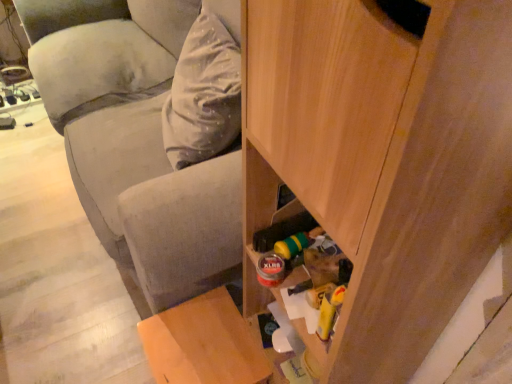
The image size is (512, 384). Find the location of `wooden cabinet at lower right`. wooden cabinet at lower right is located at coordinates (382, 161).

Image resolution: width=512 pixels, height=384 pixels. What do you see at coordinates (204, 343) in the screenshot?
I see `wooden stool at lower left` at bounding box center [204, 343].

Locate an element on the screen. wooden cabinet at lower right is located at coordinates (382, 161).

In terms of size, does wooden cabinet at lower right appear bigger or smaller than wooden stool at lower left?

Clearly, wooden cabinet at lower right is larger in size than wooden stool at lower left.

From a real-world perspective, between wooden cabinet at lower right and wooden stool at lower left, who is vertically higher?

wooden cabinet at lower right is physically above.

Does wooden cabinet at lower right appear on the right side of wooden stool at lower left?

Indeed, wooden cabinet at lower right is positioned on the right side of wooden stool at lower left.

Is wooden stool at lower left behind wooden cabinet at lower right?

That is True.

From a real-world perspective, is wooden stool at lower left physically above wooden cabinet at lower right?

Incorrect, from a real-world perspective, wooden stool at lower left is lower than wooden cabinet at lower right.

Is there a large distance between wooden stool at lower left and wooden cabinet at lower right?

wooden stool at lower left is near wooden cabinet at lower right, not far away.

Is point (245, 346) positioned behind point (282, 178)?

Yes.

Is velvety gray pillow at upper left positioned beyond the bounds of wooden cabinet at lower right?

velvety gray pillow at upper left lies outside wooden cabinet at lower right's area.

Consider the image. Does velvety gray pillow at upper left lie in front of wooden cabinet at lower right?

No, the depth of velvety gray pillow at upper left is greater than that of wooden cabinet at lower right.

From a real-world perspective, which is physically below, velvety gray pillow at upper left or wooden cabinet at lower right?

In real-world perspective, velvety gray pillow at upper left is lower.

How different are the orientations of velvety gray pillow at upper left and wooden cabinet at lower right in degrees?

5.49 degrees separate the facing orientations of velvety gray pillow at upper left and wooden cabinet at lower right.

Measure the distance from wooden cabinet at lower right to velvety gray pillow at upper left.

A distance of 24.25 inches exists between wooden cabinet at lower right and velvety gray pillow at upper left.

Are wooden cabinet at lower right and velvety gray pillow at upper left beside each other?

wooden cabinet at lower right is not next to velvety gray pillow at upper left, and they're not touching.

Does wooden cabinet at lower right have a smaller size compared to velvety gray pillow at upper left?

No, wooden cabinet at lower right is not smaller than velvety gray pillow at upper left.

Between wooden cabinet at lower right and velvety gray pillow at upper left, which one appears on the right side from the viewer's perspective?

wooden cabinet at lower right.

Which is nearer, (221, 107) or (198, 376)?

Point (221, 107).

Is velvety gray pillow at upper left placed right next to wooden stool at lower left?

No, velvety gray pillow at upper left is not next to wooden stool at lower left.

Between velvety gray pillow at upper left and wooden stool at lower left, which one is positioned in front?

wooden stool at lower left is closer to the camera.

From the image's perspective, does velvety gray pillow at upper left appear lower than wooden stool at lower left?

No.

Is velvety gray pillow at upper left at the back of wooden stool at lower left?

No.

Which is in front, wooden stool at lower left or velvety gray pillow at upper left?

Positioned in front is wooden stool at lower left.

What's the angular difference between wooden stool at lower left and velvety gray pillow at upper left's facing directions?

5.49 degrees separate the facing orientations of wooden stool at lower left and velvety gray pillow at upper left.

Locate an element on the screen. The height and width of the screenshot is (384, 512). pillow above the wooden stool at lower left (from the image's perspective) is located at coordinates (205, 88).

In order to click on cabinetry above the wooden stool at lower left (from the image's perspective) in this screenshot , I will do `click(382, 161)`.

Where is `cabinetry above the wooden stool at lower left (from a real-world perspective)`? Image resolution: width=512 pixels, height=384 pixels. cabinetry above the wooden stool at lower left (from a real-world perspective) is located at coordinates (382, 161).

Based on their spatial positions, is velvety gray pillow at upper left or wooden cabinet at lower right closer to wooden stool at lower left?

wooden cabinet at lower right lies closer to wooden stool at lower left than the other object.

Estimate the real-world distances between objects in this image. Which object is closer to velvety gray pillow at upper left, wooden cabinet at lower right or wooden stool at lower left?

wooden stool at lower left.

Estimate the real-world distances between objects in this image. Which object is closer to velvety gray pillow at upper left, wooden stool at lower left or wooden cabinet at lower right?

wooden stool at lower left lies closer to velvety gray pillow at upper left than the other object.

Looking at the image, which one is located closer to wooden stool at lower left, wooden cabinet at lower right or velvety gray pillow at upper left?

wooden cabinet at lower right.

Based on their spatial positions, is wooden stool at lower left or velvety gray pillow at upper left further from wooden cabinet at lower right?

velvety gray pillow at upper left.

From the image, which object appears to be farther from wooden cabinet at lower right, velvety gray pillow at upper left or wooden stool at lower left?

Based on the image, velvety gray pillow at upper left appears to be further to wooden cabinet at lower right.

The image size is (512, 384). In order to click on cabinetry that lies between velvety gray pillow at upper left and wooden stool at lower left from top to bottom in this screenshot , I will do `click(382, 161)`.